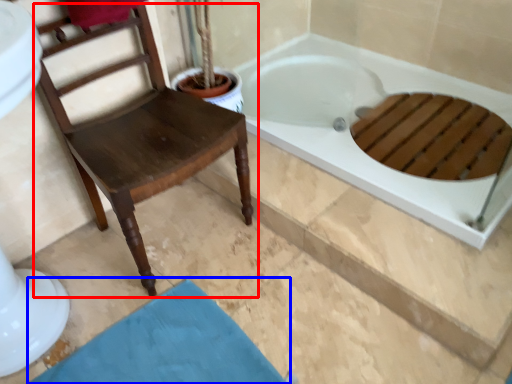
Question: Which object appears farthest to the camera in this image, chair (highlighted by a red box) or bath mat (highlighted by a blue box)?

Choices:
 (A) chair
 (B) bath mat

Answer: (B)